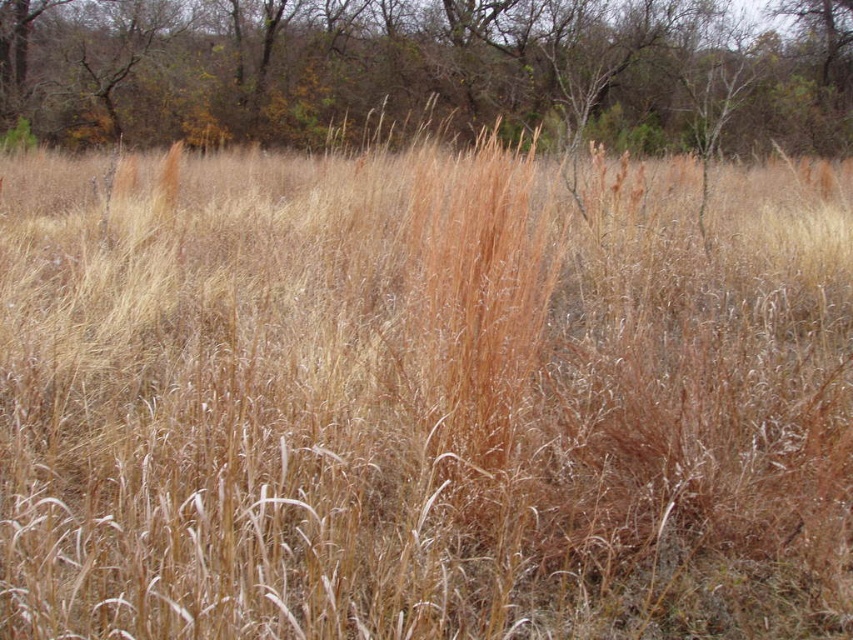
Question: Among these objects, which one is farthest from the camera?

Choices:
 (A) brown grass at center
 (B) brown textured grass at upper center

Answer: (B)

Question: Which point is farther to the camera?

Choices:
 (A) (749, 100)
 (B) (463, 342)

Answer: (A)

Question: Can you confirm if brown textured grass at upper center is thinner than brown grass at center?

Choices:
 (A) yes
 (B) no

Answer: (B)

Question: Can you confirm if brown textured grass at upper center is bigger than brown grass at center?

Choices:
 (A) no
 (B) yes

Answer: (B)

Question: Can you confirm if brown textured grass at upper center is smaller than brown grass at center?

Choices:
 (A) yes
 (B) no

Answer: (B)

Question: Which object is farther from the camera taking this photo?

Choices:
 (A) brown textured grass at upper center
 (B) brown grass at center

Answer: (A)